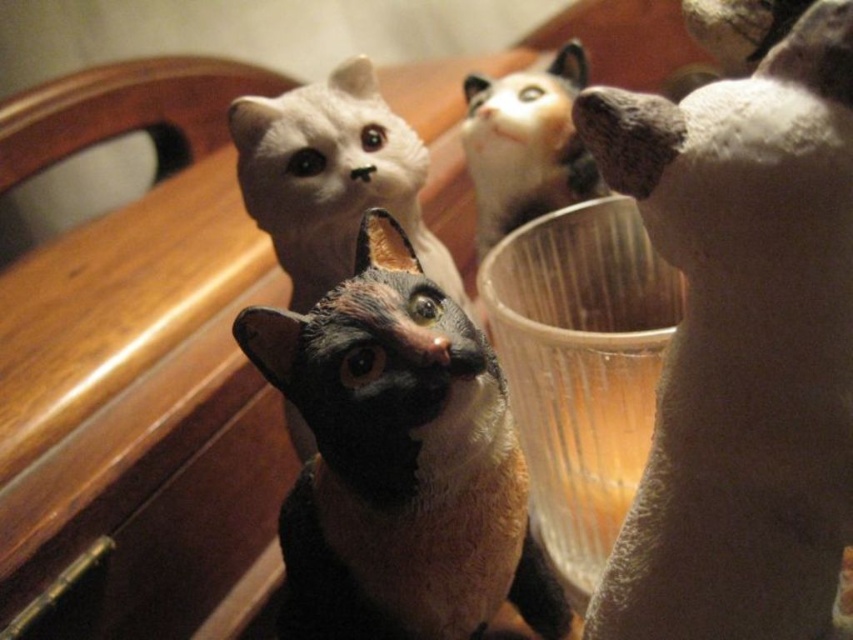
Question: Among these objects, which one is nearest to the camera?

Choices:
 (A) white plush cat at upper right
 (B) white fur cat at upper right
 (C) matte white cat at upper center
 (D) black glossy cat at center

Answer: (A)

Question: Is white plush cat at upper right closer to camera compared to black glossy cat at center?

Choices:
 (A) yes
 (B) no

Answer: (A)

Question: Which point is farther from the camera taking this photo?

Choices:
 (A) (233, 140)
 (B) (471, 83)
 (C) (543, 570)

Answer: (B)

Question: In this image, where is matte white cat at upper center located relative to white fur cat at upper right?

Choices:
 (A) right
 (B) left

Answer: (B)

Question: Which point is closer to the camera?

Choices:
 (A) white fur cat at upper right
 (B) white plush cat at upper right

Answer: (B)

Question: Does matte white cat at upper center have a greater width compared to white fur cat at upper right?

Choices:
 (A) no
 (B) yes

Answer: (B)